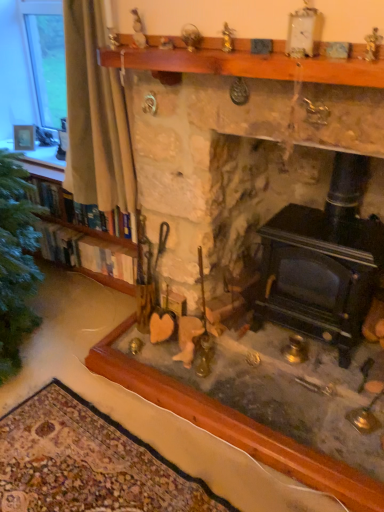
Find the location of a particular element. This screenshot has width=384, height=512. black cast iron wood burning stove at lower right is located at coordinates (323, 262).

What is the approximate width of wooden mantle at upper center?

wooden mantle at upper center is 8.36 inches wide.

Measure the distance between matte silver picture frame at upper left and camera.

matte silver picture frame at upper left is 2.72 meters away from camera.

I want to click on black cast iron wood burning stove at lower right, so click(323, 262).

In terms of width, does wooden mantle at upper center look wider or thinner when compared to wooden bookshelf at left?

In the image, wooden mantle at upper center appears to be wider than wooden bookshelf at left.

Is wooden mantle at upper center closer to camera compared to wooden bookshelf at left?

Yes, wooden mantle at upper center is in front of wooden bookshelf at left.

Is wooden mantle at upper center located outside wooden bookshelf at left?

Yes.

Is point (377, 65) closer to viewer compared to point (84, 252)?

Yes, it is in front of point (84, 252).

Is matte silver picture frame at upper left not inside wooden bookshelf at left?

That's correct, matte silver picture frame at upper left is outside of wooden bookshelf at left.

From a real-world perspective, is matte silver picture frame at upper left below wooden bookshelf at left?

No, from a real-world perspective, matte silver picture frame at upper left is not beneath wooden bookshelf at left.

In the scene shown: Does matte silver picture frame at upper left come in front of wooden bookshelf at left?

No, matte silver picture frame at upper left is further to the viewer.

Is black cast iron wood burning stove at lower right facing away from wooden bookshelf at left?

No, wooden bookshelf at left is not at the back of black cast iron wood burning stove at lower right.

Is point (351, 306) farther from camera compared to point (57, 190)?

No, (351, 306) is in front of (57, 190).

Find the location of a particular element. shelf above the black cast iron wood burning stove at lower right (from the image's perspective) is located at coordinates (89, 247).

Between white fabric curtain at left and black cast iron wood burning stove at lower right, which one has larger width?

Wider between the two is black cast iron wood burning stove at lower right.

Can you tell me how much white fabric curtain at left and black cast iron wood burning stove at lower right differ in facing direction?

4.59 degrees separate the facing orientations of white fabric curtain at left and black cast iron wood burning stove at lower right.

Is white fabric curtain at left closer to camera compared to black cast iron wood burning stove at lower right?

No, it is not.

Does black cast iron wood burning stove at lower right contain stone fireplace at center?

No, stone fireplace at center is not a part of black cast iron wood burning stove at lower right.

Between black cast iron wood burning stove at lower right and stone fireplace at center, which one has less height?

Standing shorter between the two is black cast iron wood burning stove at lower right.

Is point (334, 172) positioned before point (147, 56)?

No, (334, 172) is behind (147, 56).

From a real-world perspective, between black cast iron wood burning stove at lower right and stone fireplace at center, who is vertically higher?

In real-world perspective, stone fireplace at center is above.

In the scene shown: Which is correct: wooden bookshelf at left is inside black cast iron wood burning stove at lower right, or outside of it?

wooden bookshelf at left exists outside the volume of black cast iron wood burning stove at lower right.

Is wooden bookshelf at left at the right side of black cast iron wood burning stove at lower right?

No.

From the picture: Is wooden bookshelf at left directly adjacent to black cast iron wood burning stove at lower right?

wooden bookshelf at left and black cast iron wood burning stove at lower right are not in contact.

Could you tell me if wooden mantle at upper center is turned towards matte silver picture frame at upper left?

No, wooden mantle at upper center is not oriented towards matte silver picture frame at upper left.

Which is nearer, (99, 55) or (14, 146)?

The point (99, 55) is closer.

Where is `picture frame located underneath the wooden mantle at upper center (from a real-world perspective)`? picture frame located underneath the wooden mantle at upper center (from a real-world perspective) is located at coordinates (24, 137).

Locate an element on the screen. shelf that appears below the wooden mantle at upper center (from the image's perspective) is located at coordinates (89, 247).

Where is `picture frame above the wooden bookshelf at left (from a real-world perspective)`? The height and width of the screenshot is (512, 384). picture frame above the wooden bookshelf at left (from a real-world perspective) is located at coordinates (24, 137).

Looking at the image, which one is located closer to white fabric curtain at left, wooden mantle at upper center or wooden bookshelf at left?

wooden mantle at upper center is closer to white fabric curtain at left.

Which object lies nearer to the anchor point stone fireplace at center, matte silver picture frame at upper left or white fabric curtain at left?

white fabric curtain at left.

Considering their positions, is stone fireplace at center positioned closer to black cast iron wood burning stove at lower right than wooden mantle at upper center?

The object closer to black cast iron wood burning stove at lower right is stone fireplace at center.

From the image, which object appears to be farther from matte silver picture frame at upper left, white fabric curtain at left or black cast iron wood burning stove at lower right?

black cast iron wood burning stove at lower right is further to matte silver picture frame at upper left.

Based on the photo, looking at the image, which one is located further to matte silver picture frame at upper left, wooden mantle at upper center or wooden bookshelf at left?

Among the two, wooden mantle at upper center is located further to matte silver picture frame at upper left.

Based on their spatial positions, is matte silver picture frame at upper left or black cast iron wood burning stove at lower right further from stone fireplace at center?

matte silver picture frame at upper left is positioned further to the anchor stone fireplace at center.

Based on their spatial positions, is stone fireplace at center or wooden bookshelf at left closer to wooden mantle at upper center?

wooden bookshelf at left lies closer to wooden mantle at upper center than the other object.

When comparing their distances from white fabric curtain at left, does wooden bookshelf at left or stone fireplace at center seem further?

stone fireplace at center.

Where is `wood burning stove located between stone fireplace at center and matte silver picture frame at upper left in the depth direction`? The height and width of the screenshot is (512, 384). wood burning stove located between stone fireplace at center and matte silver picture frame at upper left in the depth direction is located at coordinates (323, 262).

Identify the location of curtain between matte silver picture frame at upper left and black cast iron wood burning stove at lower right in the horizontal direction. (95, 116).

Locate an element on the screen. The height and width of the screenshot is (512, 384). mantle between stone fireplace at center and black cast iron wood burning stove at lower right along the z-axis is located at coordinates (250, 63).

At what (x,y) coordinates should I click in order to perform the action: click on mantle between wooden bookshelf at left and black cast iron wood burning stove at lower right in the horizontal direction. Please return your answer as a coordinate pair (x, y). The width and height of the screenshot is (384, 512). Looking at the image, I should click on (250, 63).